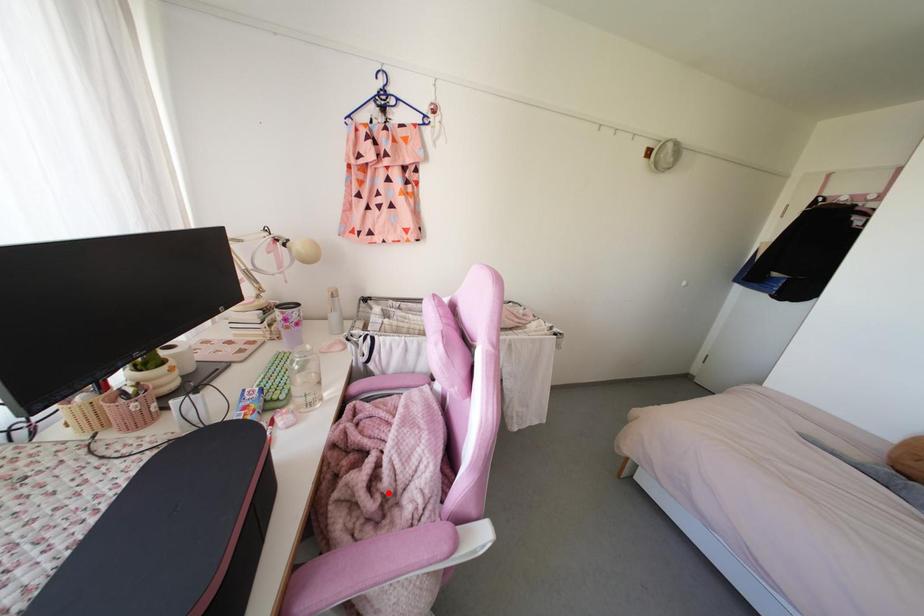
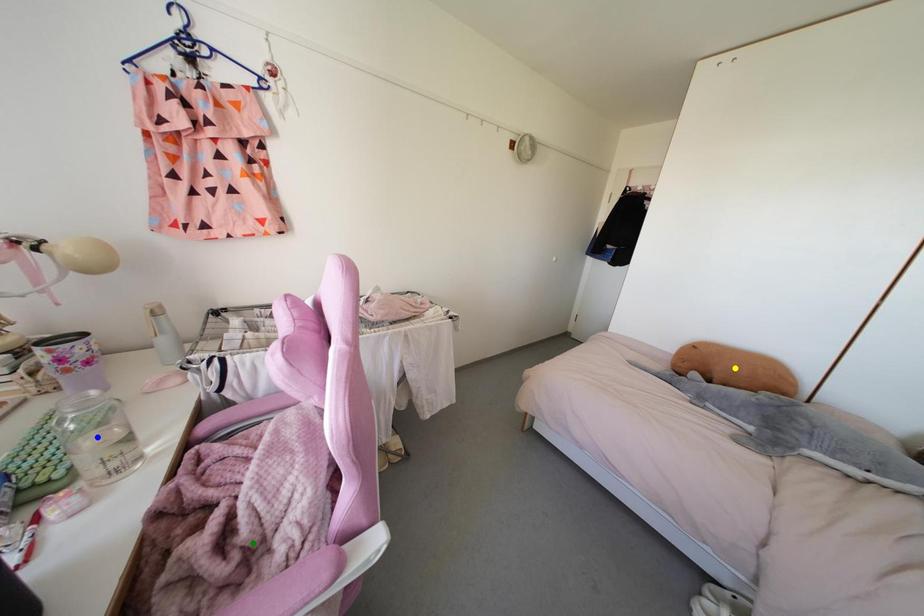
Question: I am providing you with two images of the same scene from different viewpoints. A red point is marked on the first image. You are given multiple points on the second image. Which mark in image 2 goes with the point in image 1?

Choices:
 (A) blue point
 (B) green point
 (C) yellow point

Answer: (B)